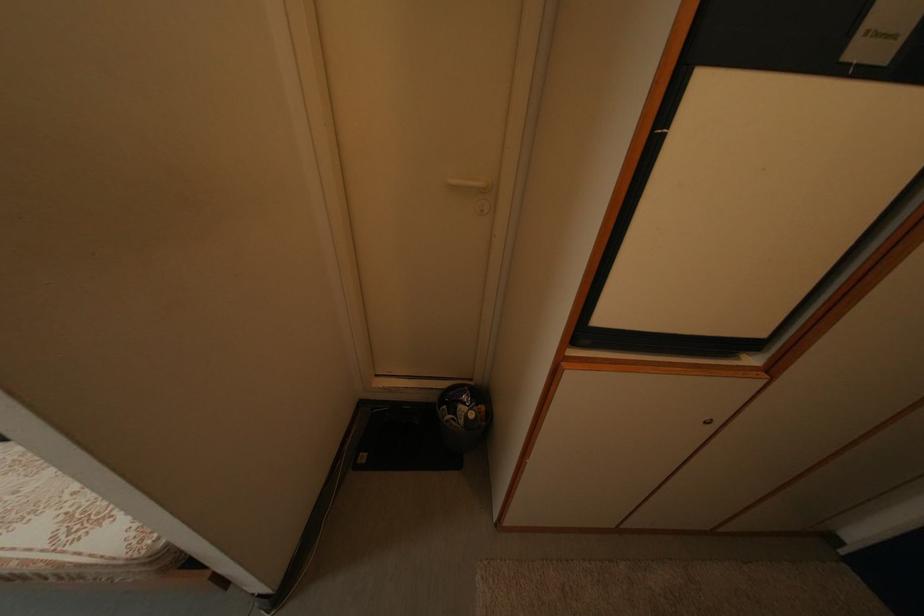
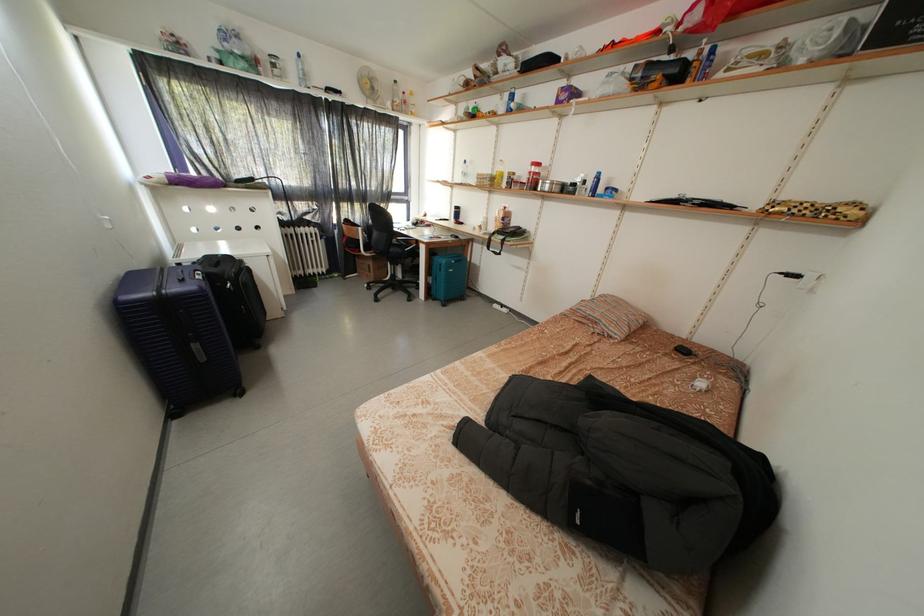
Question: The camera is either moving clockwise (left) or counter-clockwise (right) around the object. The first image is from the beginning of the video and the second image is from the end. Is the camera moving left or right when shooting the video?

Choices:
 (A) Left
 (B) Right

Answer: (B)